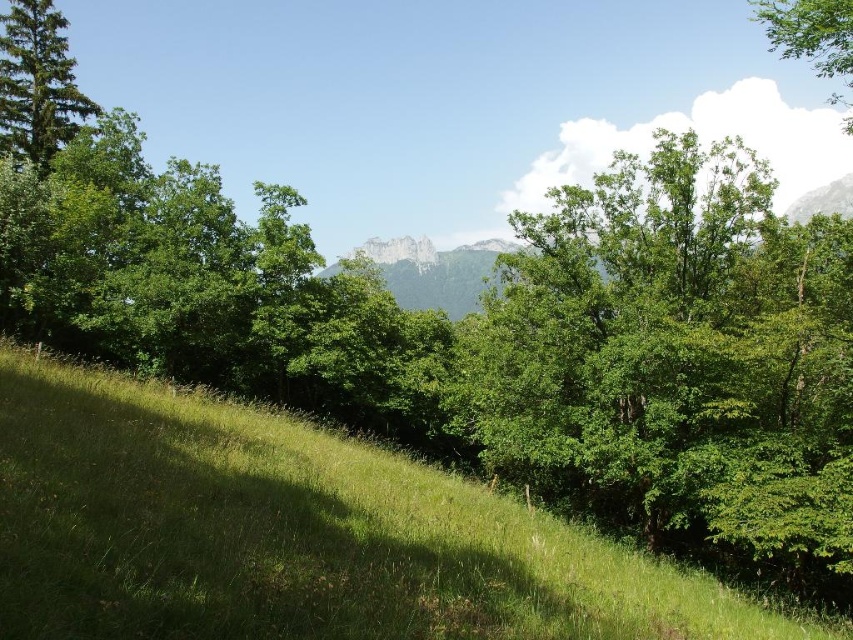
Is green grassy hillside at lower left taller than green matte tree at upper left?

No, green grassy hillside at lower left is not taller than green matte tree at upper left.

Measure the distance from green grassy hillside at lower left to green matte tree at upper left.

green grassy hillside at lower left and green matte tree at upper left are 115.20 feet apart.

Is point (386, 592) positioned after point (45, 148)?

No.

Where is `green grassy hillside at lower left`? This screenshot has height=640, width=853. green grassy hillside at lower left is located at coordinates (296, 534).

Between point (660, 481) and point (828, 42), which one is positioned in front?

Point (828, 42) is in front.

Does green leafy tree at center have a larger size compared to green leafy tree at upper right?

Actually, green leafy tree at center might be smaller than green leafy tree at upper right.

At what (x,y) coordinates should I click in order to perform the action: click on green leafy tree at center. Please return your answer as a coordinate pair (x, y). This screenshot has width=853, height=640. Looking at the image, I should click on (674, 360).

Image resolution: width=853 pixels, height=640 pixels. In order to click on green leafy tree at center in this screenshot , I will do `click(674, 360)`.

In the scene shown: Does green grassy hillside at lower left have a larger size compared to green leafy tree at center?

Actually, green grassy hillside at lower left might be smaller than green leafy tree at center.

Is green grassy hillside at lower left above green leafy tree at center?

No, green grassy hillside at lower left is not above green leafy tree at center.

Locate an element on the screen. The width and height of the screenshot is (853, 640). green grassy hillside at lower left is located at coordinates (296, 534).